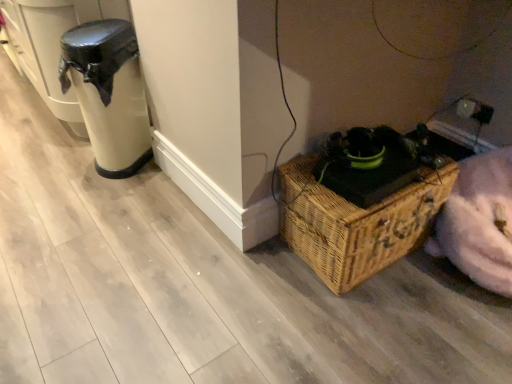
Question: From the image's perspective, is woven brown picnic basket at lower right positioned above or below matte black trash can at left?

Choices:
 (A) below
 (B) above

Answer: (A)

Question: Is woven brown picnic basket at lower right taller or shorter than matte black trash can at left?

Choices:
 (A) tall
 (B) short

Answer: (B)

Question: Is point (280, 168) closer or farther from the camera than point (144, 110)?

Choices:
 (A) farther
 (B) closer

Answer: (B)

Question: From a real-world perspective, is matte black trash can at left positioned above or below woven brown picnic basket at lower right?

Choices:
 (A) above
 (B) below

Answer: (A)

Question: Is matte black trash can at left in front of or behind woven brown picnic basket at lower right in the image?

Choices:
 (A) front
 (B) behind

Answer: (B)

Question: In terms of width, does matte black trash can at left look wider or thinner when compared to woven brown picnic basket at lower right?

Choices:
 (A) thin
 (B) wide

Answer: (A)

Question: Based on their sizes in the image, would you say matte black trash can at left is bigger or smaller than woven brown picnic basket at lower right?

Choices:
 (A) small
 (B) big

Answer: (A)